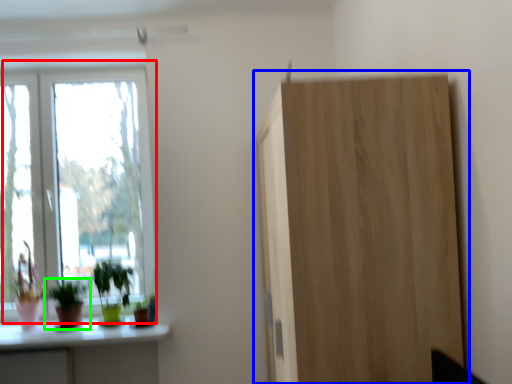
Question: Based on their relative distances, which object is nearer to window (highlighted by a red box)? Choose from cupboard (highlighted by a blue box) and houseplant (highlighted by a green box).

Choices:
 (A) cupboard
 (B) houseplant

Answer: (B)